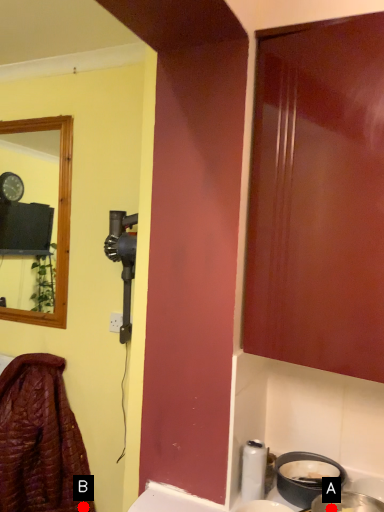
Question: Two points are circled on the image, labeled by A and B beside each circle. Which of the following is the farthest from the observer?

Choices:
 (A) A is further
 (B) B is further

Answer: (B)